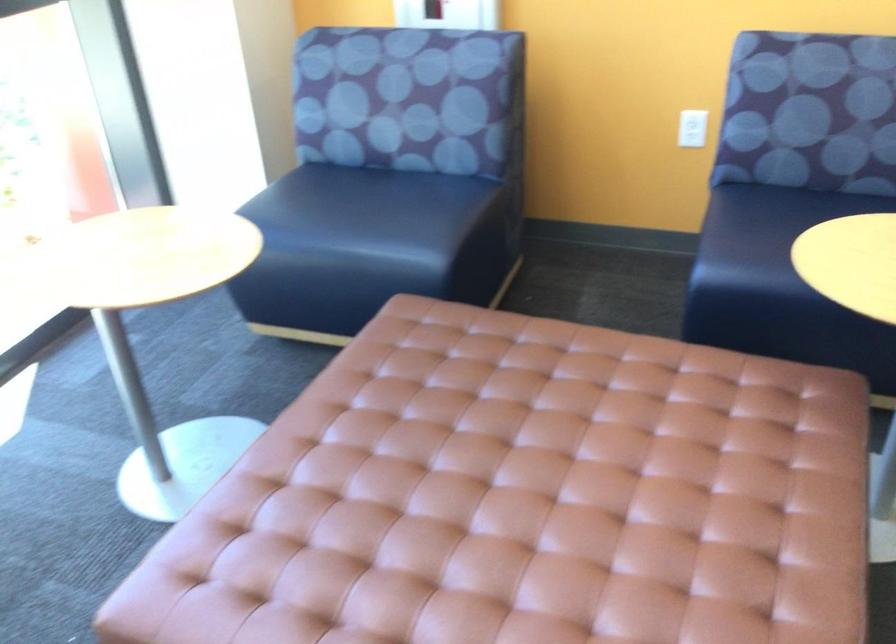
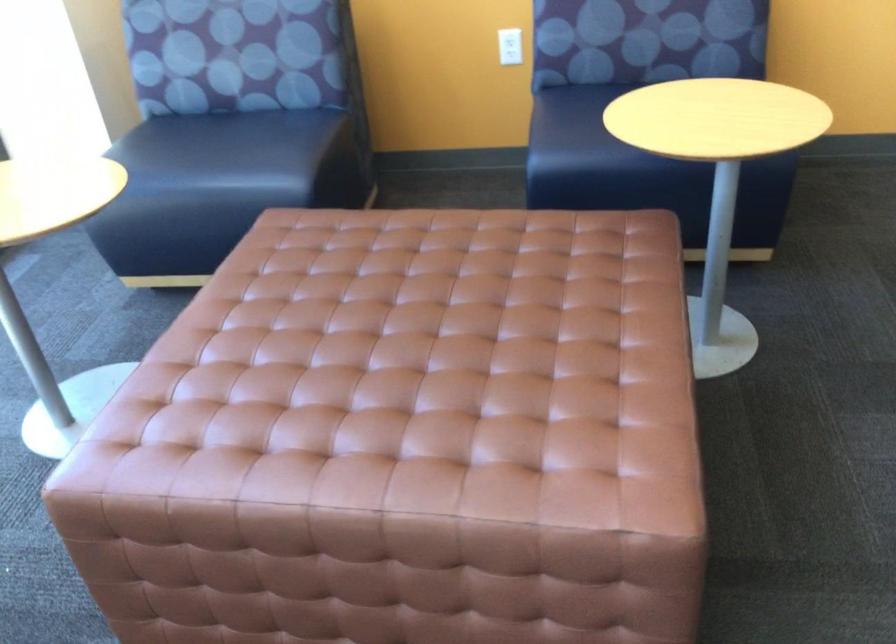
What movement of the cameraman would produce the second image?

The cameraman walked toward left, backward.